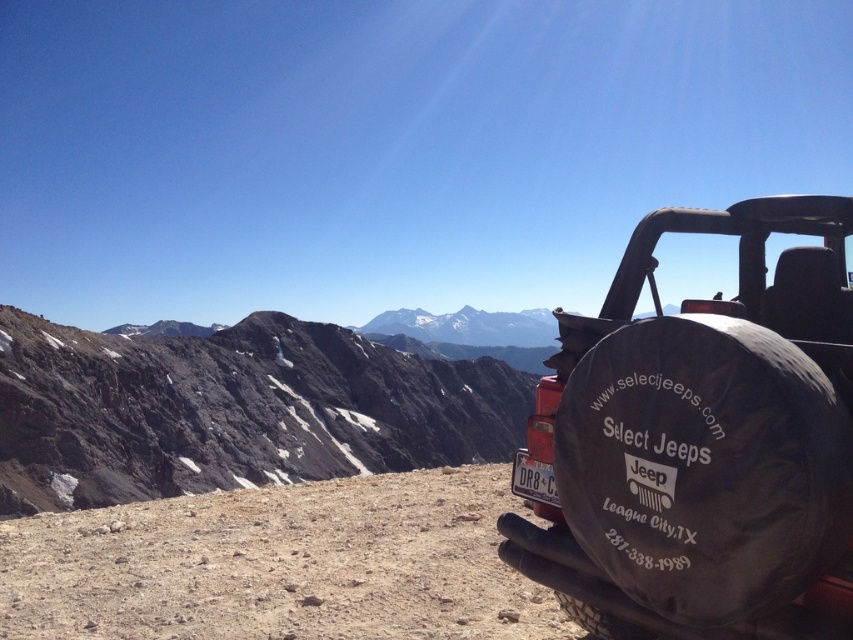
Question: Which of the following is the closest to the observer?

Choices:
 (A) black rubber tire at right
 (B) rugged stone mountain at center

Answer: (A)

Question: Can you confirm if rugged stone mountain at center is wider than white plastic license plate at center?

Choices:
 (A) no
 (B) yes

Answer: (B)

Question: Which object is closer to the camera taking this photo?

Choices:
 (A) white plastic license plate at center
 (B) black rubber tire at right

Answer: (B)

Question: Does black rubber tire at right appear on the left side of rugged stone mountain at center?

Choices:
 (A) yes
 (B) no

Answer: (B)

Question: Can you confirm if rugged stone mountain at center is bigger than white plastic license plate at center?

Choices:
 (A) yes
 (B) no

Answer: (A)

Question: Considering the real-world distances, which object is farthest from the white plastic license plate at center?

Choices:
 (A) black rubber tire at right
 (B) rugged stone mountain at center

Answer: (B)